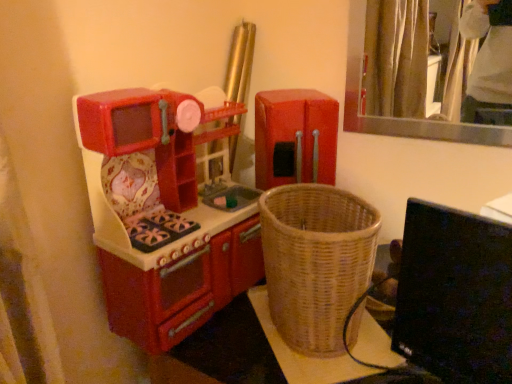
Question: Is black glossy computer monitor at lower right not inside red plastic refrigerator at center, the second appliance in the left-to-right sequence?

Choices:
 (A) yes
 (B) no

Answer: (A)

Question: From a real-world perspective, is black glossy computer monitor at lower right beneath red plastic refrigerator at center, which ranks as the 1th appliance in right-to-left order?

Choices:
 (A) yes
 (B) no

Answer: (A)

Question: From the image's perspective, would you say black glossy computer monitor at lower right is positioned over red plastic refrigerator at center, which ranks as the 1th appliance in right-to-left order?

Choices:
 (A) no
 (B) yes

Answer: (A)

Question: Considering the relative sizes of black glossy computer monitor at lower right and red plastic refrigerator at center, which ranks as the 1th appliance in right-to-left order, in the image provided, is black glossy computer monitor at lower right smaller than red plastic refrigerator at center, which ranks as the 1th appliance in right-to-left order,?

Choices:
 (A) no
 (B) yes

Answer: (B)

Question: Considering the relative sizes of black glossy computer monitor at lower right and red plastic refrigerator at center, which ranks as the 1th appliance in right-to-left order, in the image provided, is black glossy computer monitor at lower right shorter than red plastic refrigerator at center, which ranks as the 1th appliance in right-to-left order,?

Choices:
 (A) no
 (B) yes

Answer: (A)

Question: From the image's perspective, is black glossy computer monitor at lower right positioned above or below woven wicker basket at lower right?

Choices:
 (A) below
 (B) above

Answer: (B)

Question: Looking at their shapes, would you say black glossy computer monitor at lower right is wider or thinner than woven wicker basket at lower right?

Choices:
 (A) thin
 (B) wide

Answer: (A)

Question: Is point click(x=499, y=249) positioned closer to the camera than point click(x=340, y=357)?

Choices:
 (A) closer
 (B) farther

Answer: (A)

Question: Considering the positions of black glossy computer monitor at lower right and woven wicker basket at lower right in the image, is black glossy computer monitor at lower right bigger or smaller than woven wicker basket at lower right?

Choices:
 (A) small
 (B) big

Answer: (B)

Question: In the image, is red plastic refrigerator at center, which ranks as the 1th appliance in right-to-left order, on the left side or the right side of woven wicker basket at lower right?

Choices:
 (A) left
 (B) right

Answer: (A)

Question: From a real-world perspective, relative to woven wicker basket at lower right, is red plastic refrigerator at center, which ranks as the 1th appliance in right-to-left order, vertically above or below?

Choices:
 (A) below
 (B) above

Answer: (B)

Question: Is red plastic refrigerator at center, the second appliance in the left-to-right sequence, inside the boundaries of woven wicker basket at lower right, or outside?

Choices:
 (A) outside
 (B) inside

Answer: (A)

Question: Relative to woven wicker basket at lower right, is red plastic refrigerator at center, which ranks as the 1th appliance in right-to-left order, in front or behind?

Choices:
 (A) behind
 (B) front

Answer: (A)

Question: In the image, is matte plastic toy kitchen at left, which ranks as the second appliance in right-to-left order, positioned in front of or behind red plastic refrigerator at center, the second appliance in the left-to-right sequence?

Choices:
 (A) behind
 (B) front

Answer: (B)

Question: Which is correct: matte plastic toy kitchen at left, the first appliance when ordered from left to right, is inside red plastic refrigerator at center, which ranks as the 1th appliance in right-to-left order, or outside of it?

Choices:
 (A) inside
 (B) outside

Answer: (B)